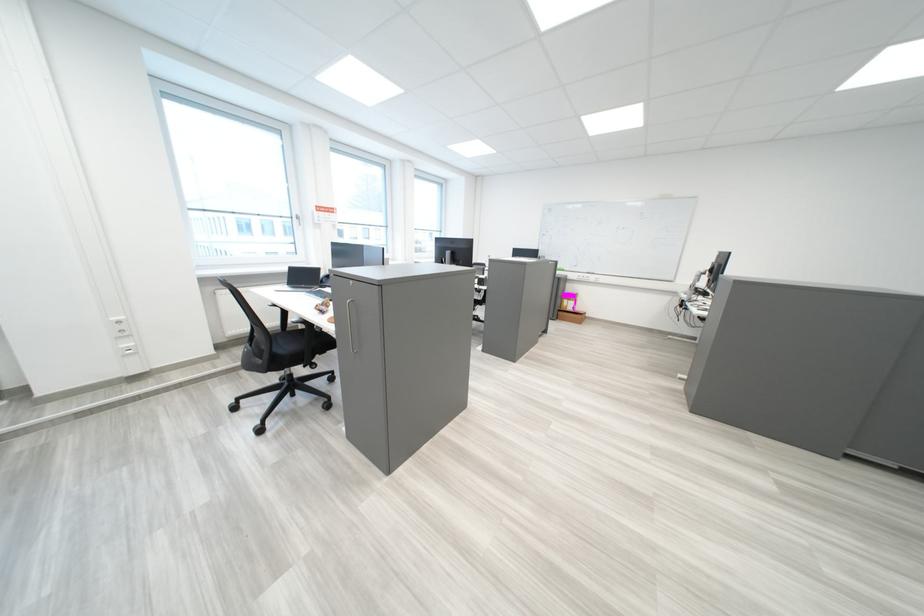
I want to click on black chair sitting surface, so click(288, 339).